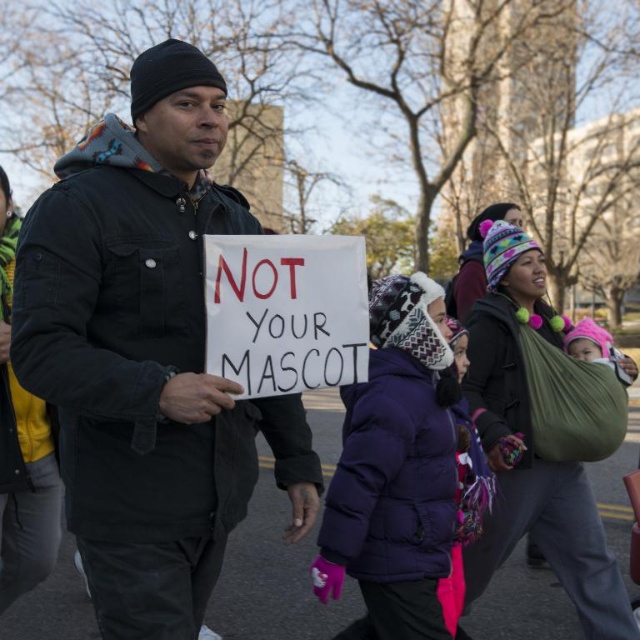
You are a photographer at the protest. You want to take a photo of the matte black jacket at center and the purple puffy coat at center. The minimum distance your camera can focus on two objects clearly is 34 inches. Will both subjects be in focus?

The distance between the matte black jacket at center and the purple puffy coat at center is 33.81 inches, which is just below the camera minimum focus distance of 34 inches. Therefore, both subjects will be in focus.

You are a photographer trying to capture a photo of the matte black jacket at center and the purple puffy coat at center. Which one should you focus on first if you want to include both in your frame?

The matte black jacket at center is positioned on the left side of the purple puffy coat at center, so you should focus on the matte black jacket at center first to ensure both are in frame.